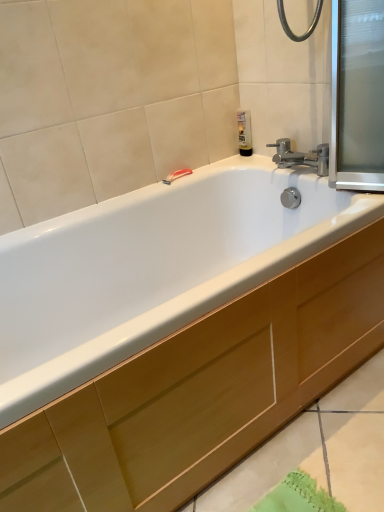
Question: From a real-world perspective, does wooden cabinet at lower center sit lower than transparent glass screen door at upper right?

Choices:
 (A) yes
 (B) no

Answer: (A)

Question: Considering the relative sizes of wooden cabinet at lower center and transparent glass screen door at upper right in the image provided, is wooden cabinet at lower center bigger than transparent glass screen door at upper right?

Choices:
 (A) yes
 (B) no

Answer: (A)

Question: Are wooden cabinet at lower center and transparent glass screen door at upper right located far from each other?

Choices:
 (A) no
 (B) yes

Answer: (A)

Question: Is wooden cabinet at lower center facing away from transparent glass screen door at upper right?

Choices:
 (A) yes
 (B) no

Answer: (B)

Question: Is wooden cabinet at lower center shorter than transparent glass screen door at upper right?

Choices:
 (A) no
 (B) yes

Answer: (B)

Question: Could transparent glass screen door at upper right be considered to be inside wooden cabinet at lower center?

Choices:
 (A) yes
 (B) no

Answer: (B)

Question: Is red plastic towel bar at upper center at the right side of translucent plastic soap dispenser at upper right?

Choices:
 (A) no
 (B) yes

Answer: (A)

Question: Is red plastic towel bar at upper center oriented towards translucent plastic soap dispenser at upper right?

Choices:
 (A) yes
 (B) no

Answer: (B)

Question: Does red plastic towel bar at upper center have a lesser height compared to translucent plastic soap dispenser at upper right?

Choices:
 (A) no
 (B) yes

Answer: (B)

Question: Are red plastic towel bar at upper center and translucent plastic soap dispenser at upper right located far from each other?

Choices:
 (A) yes
 (B) no

Answer: (B)

Question: From a real-world perspective, is red plastic towel bar at upper center on top of translucent plastic soap dispenser at upper right?

Choices:
 (A) yes
 (B) no

Answer: (B)

Question: Does red plastic towel bar at upper center lie in front of translucent plastic soap dispenser at upper right?

Choices:
 (A) no
 (B) yes

Answer: (B)

Question: Is transparent glass screen door at upper right looking in the opposite direction of wooden cabinet at lower center?

Choices:
 (A) no
 (B) yes

Answer: (A)